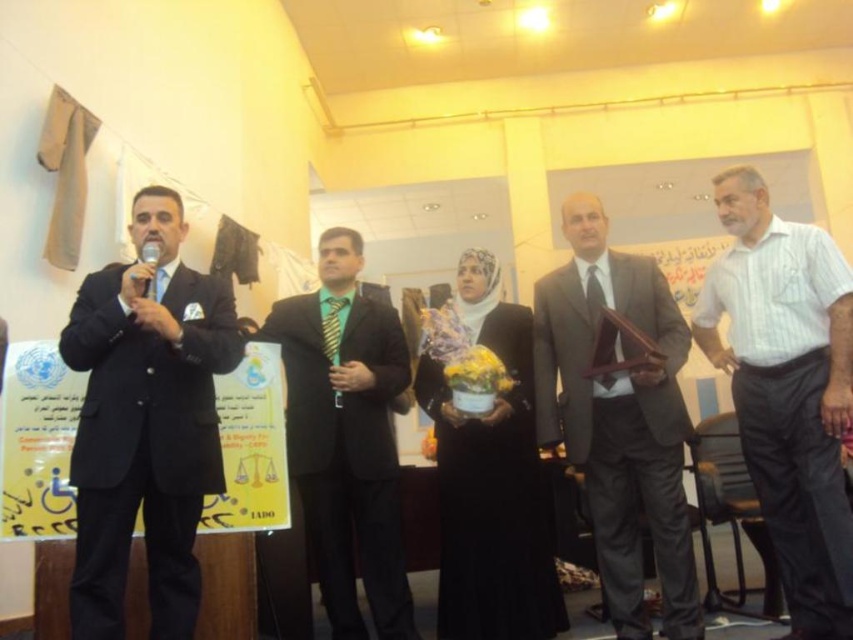
Who is lower down, black suit at left or matte gray suit at center?

matte gray suit at center is below.

From the picture: Is black suit at left below matte gray suit at center?

No.

Is point (141, 458) farther from camera compared to point (622, 260)?

That is False.

Where is `black suit at left`? This screenshot has width=853, height=640. black suit at left is located at coordinates (146, 422).

Does black suit at left have a lesser height compared to metallic silver microphone at left?

No.

Who is shorter, black suit at left or metallic silver microphone at left?

With less height is metallic silver microphone at left.

Where is `black suit at left`? black suit at left is located at coordinates (146, 422).

How distant is white striped shirt at center from matte gray suit at center?

white striped shirt at center is 17.27 inches from matte gray suit at center.

Measure the distance from white striped shirt at center to matte gray suit at center.

white striped shirt at center is 43.88 centimeters from matte gray suit at center.

Is point (717, 200) closer to viewer compared to point (688, 428)?

No, it is not.

The width and height of the screenshot is (853, 640). Find the location of `white striped shirt at center`. white striped shirt at center is located at coordinates (787, 388).